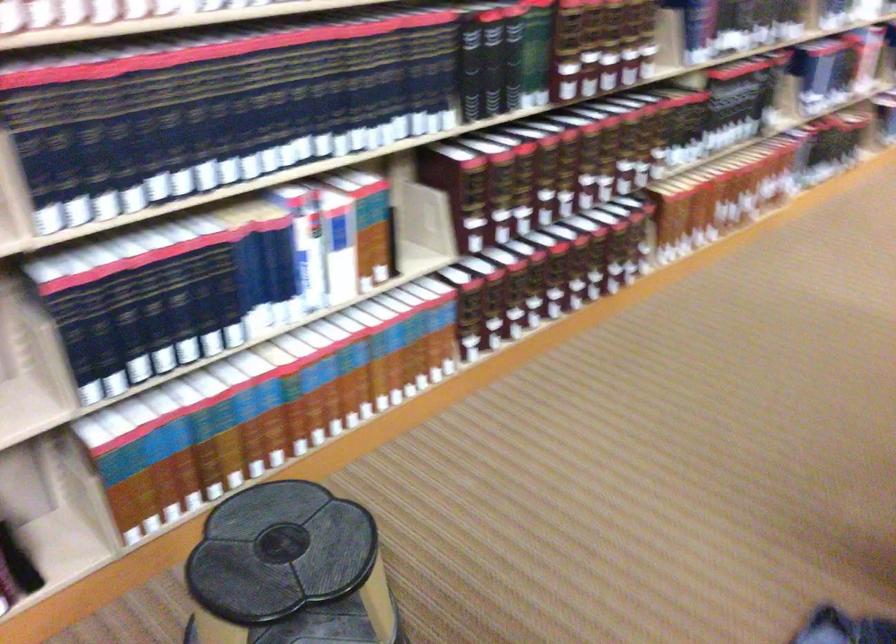
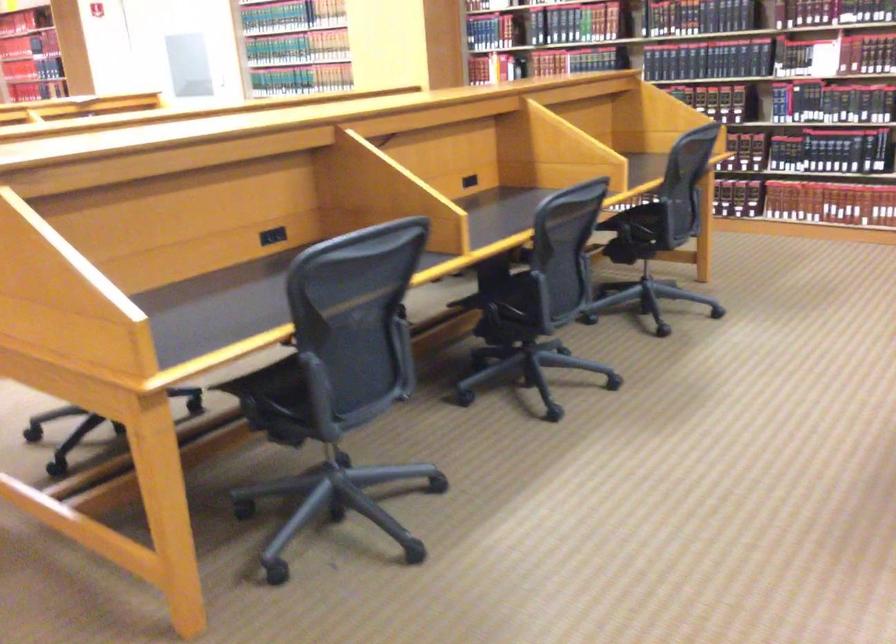
Question: I am providing you with two images of the same scene from different viewpoints. Please identify which objects are invisible in image2.

Choices:
 (A) hardcover book
 (B) chair sitting surface
 (C) black spine book
 (D) orange helmet

Answer: (C)